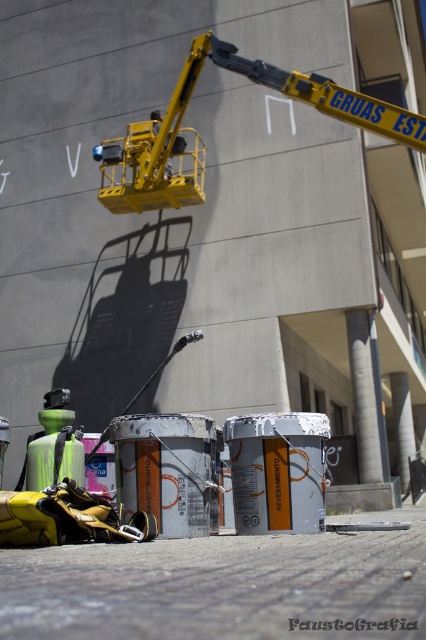
You are a worker on the street and need to move a large equipment box. There is limited space between the yellow metallic crane at upper center and the yellow metallic crane arm at upper center. Can you fit the box there?

The yellow metallic crane at upper center occupies less space than yellow metallic crane arm at upper center, so the space between them may be insufficient for the large equipment box. It is recommended to find another location with more space.

You are a worker standing on the ground looking at the yellow metallic crane at upper center and the yellow metallic crane arm at upper center. Which object is closer to you?

The yellow metallic crane at upper center is closer to you than the yellow metallic crane arm at upper center.